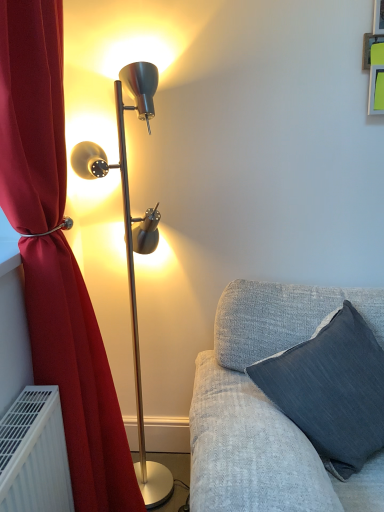
Describe the element at coordinates (332, 391) in the screenshot. I see `dark gray fabric pillow at lower right` at that location.

You are a GUI agent. You are given a task and a screenshot of the screen. Output one action in this format:
    pyautogui.click(x=<x>, y=<y>)
    Task: Click on the velvet red curtain at left
    
    Given the screenshot: What is the action you would take?
    pyautogui.click(x=78, y=376)

Is dark gray fabric pillow at lower right a part of metallic gold floor lamp at left?

No.

Considering the positions of points (138, 72) and (314, 341), is point (138, 72) closer to camera compared to point (314, 341)?

No, (138, 72) is behind (314, 341).

The width and height of the screenshot is (384, 512). Identify the location of lamp behind the dark gray fabric pillow at lower right. tap(132, 246).

Between metallic gold floor lamp at left and dark gray fabric pillow at lower right, which one appears on the right side from the viewer's perspective?

dark gray fabric pillow at lower right.

Can you confirm if metallic gold floor lamp at left is positioned to the right of velvet red curtain at left?

Yes.

Which object is closer to the camera, metallic gold floor lamp at left or velvet red curtain at left?

Positioned in front is velvet red curtain at left.

From the image's perspective, between metallic gold floor lamp at left and velvet red curtain at left, who is located below?

velvet red curtain at left appears lower in the image.

Considering the relative positions of dark gray fabric pillow at lower right and metallic gold floor lamp at left in the image provided, is dark gray fabric pillow at lower right to the left of metallic gold floor lamp at left from the viewer's perspective?

No, dark gray fabric pillow at lower right is not to the left of metallic gold floor lamp at left.

In the image, is dark gray fabric pillow at lower right positioned in front of or behind metallic gold floor lamp at left?

In the image, dark gray fabric pillow at lower right appears in front of metallic gold floor lamp at left.

From a real-world perspective, between dark gray fabric pillow at lower right and metallic gold floor lamp at left, who is vertically lower?

dark gray fabric pillow at lower right is physically lower.

Considering the points (349, 303) and (91, 413), which point is behind, point (349, 303) or point (91, 413)?

Point (349, 303)

Is dark gray fabric pillow at lower right at the right side of velvet red curtain at left?

Correct, you'll find dark gray fabric pillow at lower right to the right of velvet red curtain at left.

Is velvet red curtain at left located within dark gray fabric pillow at lower right?

No, velvet red curtain at left is not surrounded by dark gray fabric pillow at lower right.

Is there a large distance between dark gray fabric pillow at lower right and velvet red curtain at left?

Actually, dark gray fabric pillow at lower right and velvet red curtain at left are a little close together.

Can you confirm if velvet red curtain at left is taller than dark gray fabric pillow at lower right?

Indeed, velvet red curtain at left has a greater height compared to dark gray fabric pillow at lower right.

Locate an element on the screen. pillow behind the velvet red curtain at left is located at coordinates pyautogui.click(x=332, y=391).

From a real-world perspective, is velvet red curtain at left under dark gray fabric pillow at lower right?

No, from a real-world perspective, velvet red curtain at left is not under dark gray fabric pillow at lower right.

Considering the positions of objects velvet red curtain at left and dark gray fabric pillow at lower right in the image provided, who is in front, velvet red curtain at left or dark gray fabric pillow at lower right?

Positioned in front is velvet red curtain at left.

Consider the image. Could you tell me if velvet red curtain at left is turned towards metallic gold floor lamp at left?

No, velvet red curtain at left is not facing towards metallic gold floor lamp at left.

Is there a large distance between velvet red curtain at left and metallic gold floor lamp at left?

No, velvet red curtain at left is not far away from metallic gold floor lamp at left.

Considering the positions of points (59, 17) and (148, 112), is point (59, 17) closer to camera compared to point (148, 112)?

Yes, it is in front of point (148, 112).

I want to click on lamp that is above the dark gray fabric pillow at lower right (from the image's perspective), so click(x=132, y=246).

At what (x,y) coordinates should I click in order to perform the action: click on curtain on the left of metallic gold floor lamp at left. Please return your answer as a coordinate pair (x, y). The height and width of the screenshot is (512, 384). Looking at the image, I should click on (78, 376).

From the image, which object appears to be nearer to metallic gold floor lamp at left, dark gray fabric pillow at lower right or velvet red curtain at left?

velvet red curtain at left lies closer to metallic gold floor lamp at left than the other object.

Looking at this image, from the image, which object appears to be farther from velvet red curtain at left, metallic gold floor lamp at left or dark gray fabric pillow at lower right?

dark gray fabric pillow at lower right.

When comparing their distances from dark gray fabric pillow at lower right, does velvet red curtain at left or metallic gold floor lamp at left seem further?

metallic gold floor lamp at left.

Looking at the image, which one is located closer to metallic gold floor lamp at left, velvet red curtain at left or dark gray fabric pillow at lower right?

velvet red curtain at left is closer to metallic gold floor lamp at left.

From the image, which object appears to be nearer to dark gray fabric pillow at lower right, metallic gold floor lamp at left or velvet red curtain at left?

The object closer to dark gray fabric pillow at lower right is velvet red curtain at left.

Looking at the image, which one is located further to velvet red curtain at left, dark gray fabric pillow at lower right or metallic gold floor lamp at left?

Based on the image, dark gray fabric pillow at lower right appears to be further to velvet red curtain at left.

Image resolution: width=384 pixels, height=512 pixels. Find the location of `lamp located between velvet red curtain at left and dark gray fabric pillow at lower right in the left-right direction`. lamp located between velvet red curtain at left and dark gray fabric pillow at lower right in the left-right direction is located at coordinates (132, 246).